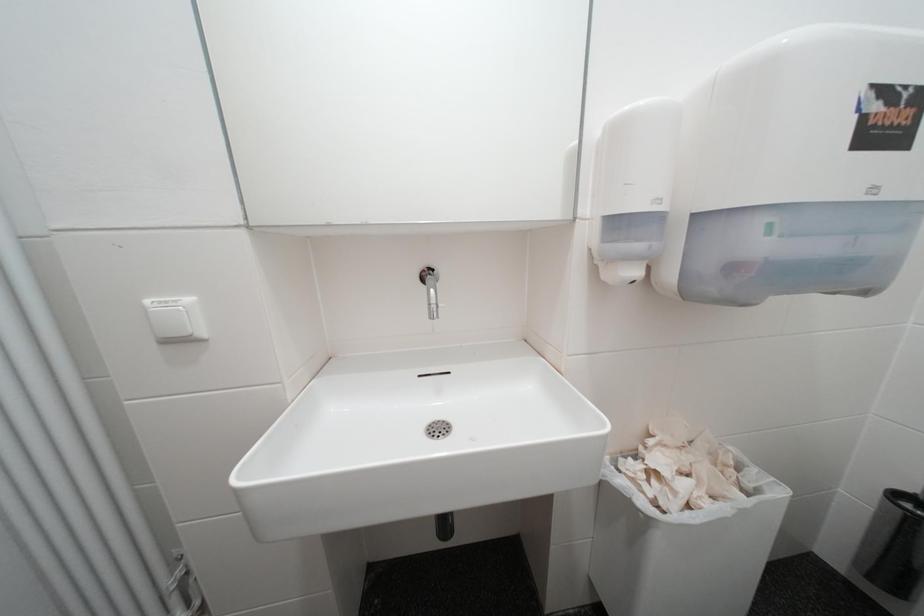
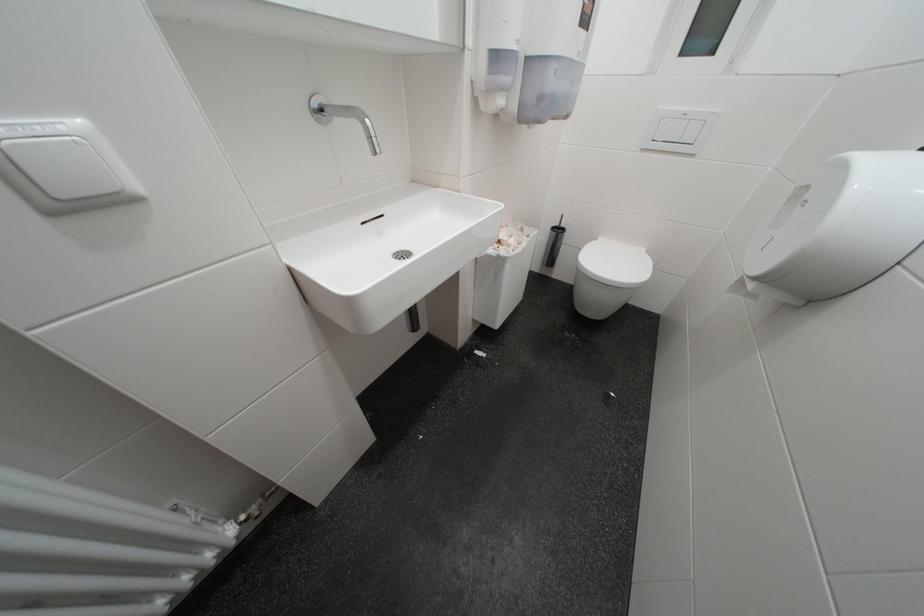
First-person continuous shooting, in which direction is the camera rotating?

The camera's rotation is toward right-down.